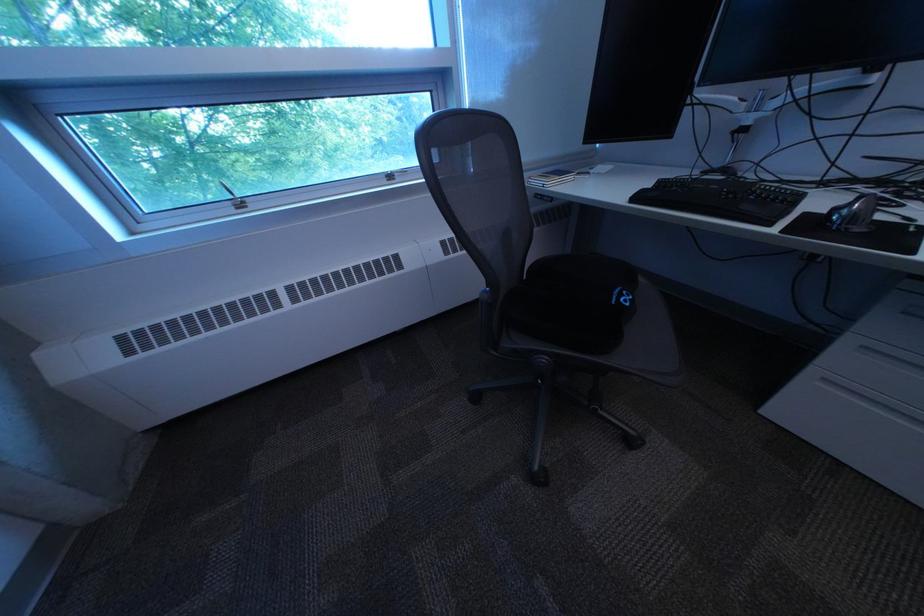
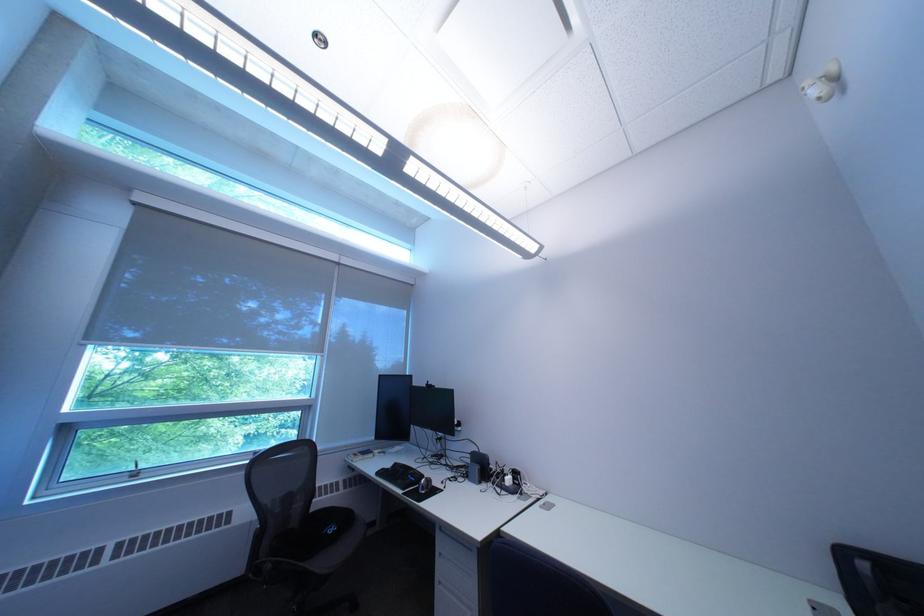
In the second image, find the point that corresponds to point 560,362 in the first image.

(285, 568)